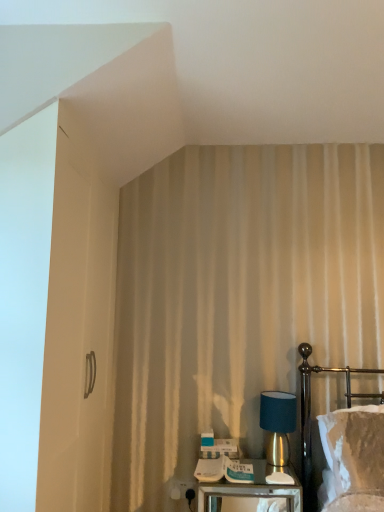
Question: Does metallic silver nightstand at lower center have a smaller size compared to velvet white bed at right?

Choices:
 (A) yes
 (B) no

Answer: (A)

Question: Is metallic silver nightstand at lower center positioned far away from velvet white bed at right?

Choices:
 (A) no
 (B) yes

Answer: (A)

Question: From the image's perspective, would you say metallic silver nightstand at lower center is positioned over velvet white bed at right?

Choices:
 (A) no
 (B) yes

Answer: (A)

Question: Is the surface of metallic silver nightstand at lower center in direct contact with velvet white bed at right?

Choices:
 (A) yes
 (B) no

Answer: (B)

Question: Considering the relative sizes of metallic silver nightstand at lower center and velvet white bed at right in the image provided, is metallic silver nightstand at lower center thinner than velvet white bed at right?

Choices:
 (A) yes
 (B) no

Answer: (B)

Question: Does metallic silver nightstand at lower center have a greater width compared to velvet white bed at right?

Choices:
 (A) no
 (B) yes

Answer: (B)

Question: Is velvet white bed at right to the right of teal fabric lampshade at right from the viewer's perspective?

Choices:
 (A) yes
 (B) no

Answer: (A)

Question: Does velvet white bed at right have a greater width compared to teal fabric lampshade at right?

Choices:
 (A) no
 (B) yes

Answer: (B)

Question: Considering the relative sizes of velvet white bed at right and teal fabric lampshade at right in the image provided, is velvet white bed at right bigger than teal fabric lampshade at right?

Choices:
 (A) yes
 (B) no

Answer: (A)

Question: From the image's perspective, is velvet white bed at right under teal fabric lampshade at right?

Choices:
 (A) yes
 (B) no

Answer: (B)

Question: Is velvet white bed at right at the left side of teal fabric lampshade at right?

Choices:
 (A) yes
 (B) no

Answer: (B)

Question: Does velvet white bed at right have a greater height compared to teal fabric lampshade at right?

Choices:
 (A) yes
 (B) no

Answer: (A)

Question: Is velvet white bed at right taller than white plastic electric outlet at lower center?

Choices:
 (A) no
 (B) yes

Answer: (B)